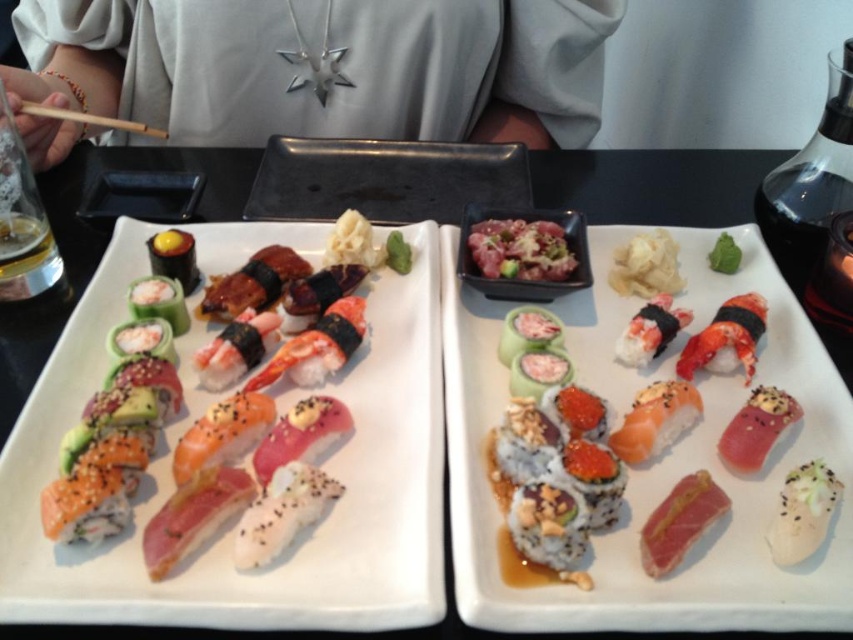
You are a customer at a sushi restaurant and want to point out two specific points on the table where the plates are placed. The first point is at coordinate [790,508] and the second is at [697,358]. From your perspective sitting at the table, which point is closer to you?

Point [790,508] is in front of point [697,358], so the first point is closer to you.

You are at a Japanese restaurant and see the image. The sushi at center is located at point (228, 529). If you want to reach the sushi at center, which direction should you move your hand from your current position at point 0.5, 0.5?

To reach the sushi at center located at point (228, 529) from your current position at point 0.5, 0.5, you should move your hand northeast. This is because the x coordinate increases to the right and the y coordinate decreases downward in the image coordinate system, so moving from 0.5,0.5 to 0.827,0.268 involves moving right and up.